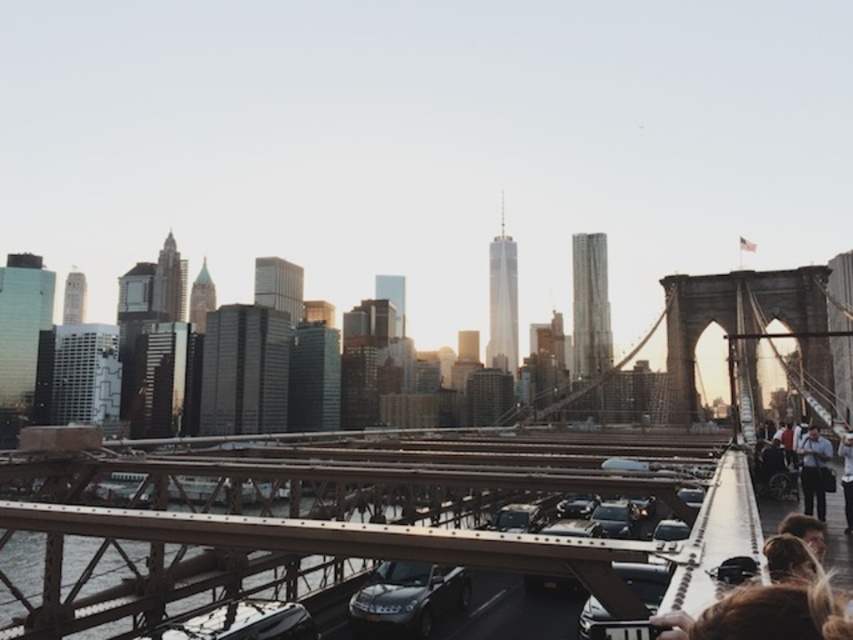
Is point (630, 522) less distant than point (572, 513)?

Yes, it is.

Find the location of a particular element. The height and width of the screenshot is (640, 853). shiny silver sedan at center is located at coordinates (614, 518).

Between point (624, 506) and point (589, 500), which one is positioned in front?

Point (624, 506) is more forward.

Where is `shiny silver sedan at center`? This screenshot has height=640, width=853. shiny silver sedan at center is located at coordinates (614, 518).

Is metallic gray sedan at center bigger than dark blue jeans at right?

Yes.

In the scene shown: How distant is metallic gray sedan at center from dark blue jeans at right?

metallic gray sedan at center and dark blue jeans at right are 32.13 meters apart from each other.

At what (x,y) coordinates should I click in order to perform the action: click on metallic gray sedan at center. Please return your answer as a coordinate pair (x, y). The height and width of the screenshot is (640, 853). Looking at the image, I should click on (408, 596).

In order to click on metallic brown bridge at center in this screenshot , I will do (294, 522).

Is the position of metallic brown bridge at center more distant than that of blonde hair at lower right?

That is True.

Who is more forward, (316, 502) or (805, 572)?

Point (805, 572)

You are a GUI agent. You are given a task and a screenshot of the screen. Output one action in this format:
    pyautogui.click(x=<x>, y=<y>)
    Task: Click on the metallic brown bridge at center
    
    Given the screenshot: What is the action you would take?
    pyautogui.click(x=294, y=522)